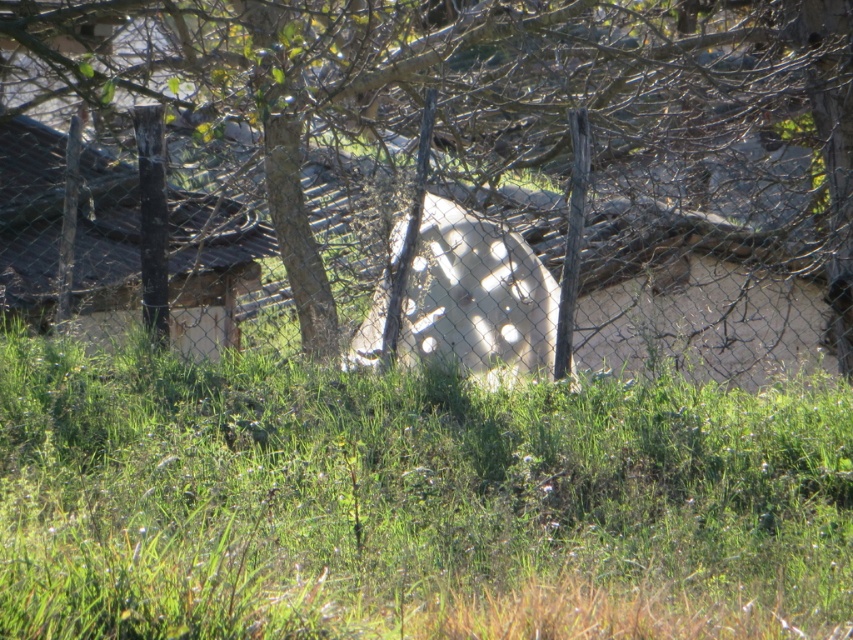
You are standing at the point marked as point (511, 163). What is the closest object to you in the scene?

The closest object to you at point (511, 163) is the green leafy tree at center, as the point is located on it.

You are standing outside the chain link fence looking at the rural scene. You notice the green leafy tree at center and the green grassy at center. Which one is taller?

The green leafy tree at center is much taller than the green grassy at center.

You are standing outside the fence and want to take a photo of both the green leafy tree at center and the white matte concrete wheel at center. Which object should you focus on first to ensure both are in sharp focus?

You should focus on the green leafy tree at center first because it is closer to the viewer than the white matte concrete wheel at center. By focusing on the closer object, the farther object will still be in acceptable focus due to the depth of field.